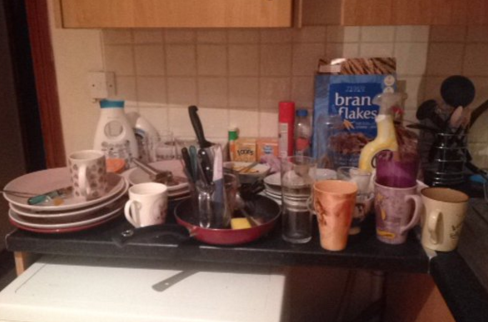
At what (x,y) coordinates should I click in order to perform the action: click on drinking glass. Please return your answer as a coordinate pair (x, y). The image size is (488, 322). Looking at the image, I should click on click(296, 224), click(356, 178), click(327, 144).